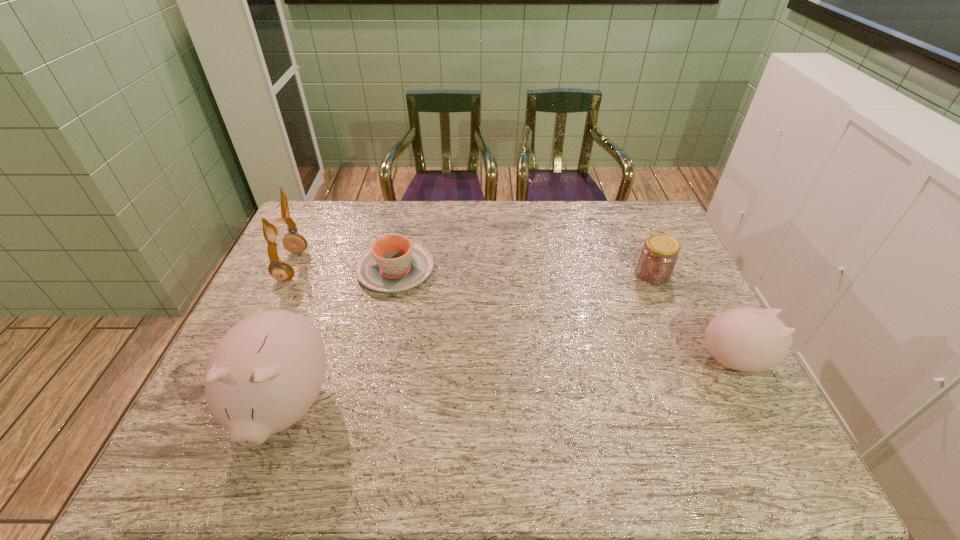
At what (x,y) coordinates should I click in order to perform the action: click on vacant region located 0.400m on the front of the second shortest object. Please return your answer as a coordinate pair (x, y). This screenshot has width=960, height=540. Looking at the image, I should click on (708, 404).

Identify the location of object positioned at the near edge. The image size is (960, 540). (265, 373).

Find the location of a particular element. This screenshot has width=960, height=540. piggy bank that is at the left edge is located at coordinates (265, 373).

Locate an element on the screen. Image resolution: width=960 pixels, height=540 pixels. earphone situated at the left edge is located at coordinates (281, 270).

Locate an element on the screen. This screenshot has width=960, height=540. piggy bank located in the right edge section of the desktop is located at coordinates (747, 339).

Where is `jam at the right edge`? Image resolution: width=960 pixels, height=540 pixels. jam at the right edge is located at coordinates (659, 255).

Identify the location of object that is at the near left corner. (265, 373).

Locate an element on the screen. The image size is (960, 540). blank space at the far edge is located at coordinates (578, 202).

Find the location of a particular element. The image size is (960, 540). free space at the near edge of the desktop is located at coordinates (492, 398).

The image size is (960, 540). I want to click on vacant area at the left edge of the desktop, so click(317, 286).